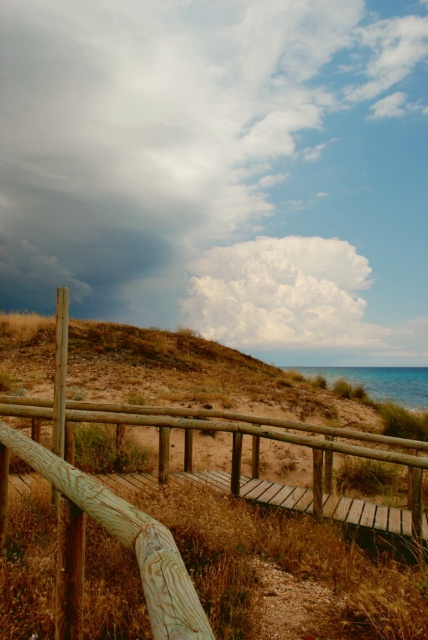
Question: Which point is closer to the camera taking this photo?

Choices:
 (A) (228, 273)
 (B) (163, 612)

Answer: (B)

Question: Is wooden at center thinner than white fluffy cloud at upper center?

Choices:
 (A) no
 (B) yes

Answer: (B)

Question: Which of the following is the farthest from the observer?

Choices:
 (A) wooden at center
 (B) white fluffy cloud at upper center

Answer: (B)

Question: Does wooden at center have a smaller size compared to white fluffy cloud at upper center?

Choices:
 (A) yes
 (B) no

Answer: (A)

Question: Is wooden at center positioned before white fluffy cloud at upper center?

Choices:
 (A) no
 (B) yes

Answer: (B)